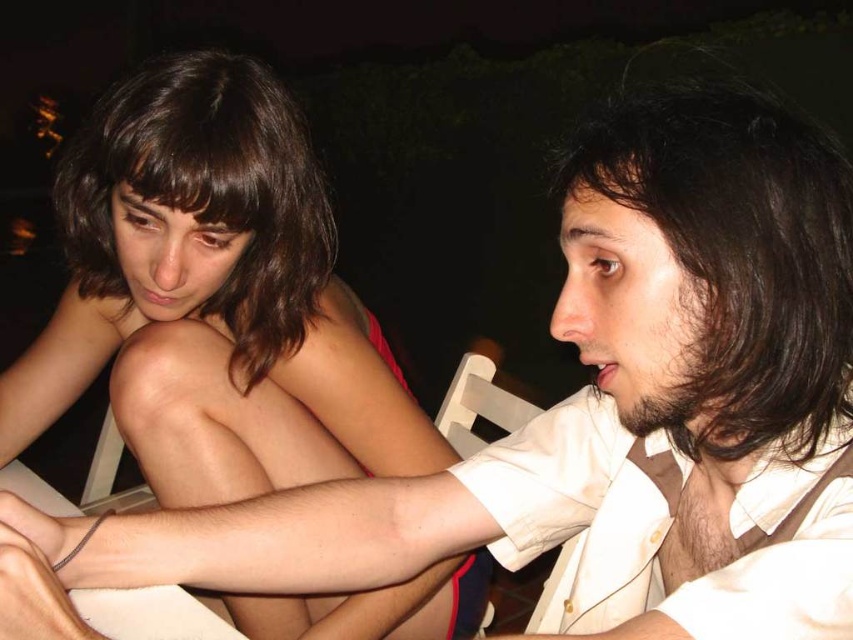
Is dark brown wavy hair at right thinner than dark brown wavy hair at upper left?

Yes.

The height and width of the screenshot is (640, 853). In order to click on dark brown wavy hair at right in this screenshot , I will do `click(735, 259)`.

Is point (827, 308) in front of point (294, 177)?

That is True.

You are a GUI agent. You are given a task and a screenshot of the screen. Output one action in this format:
    pyautogui.click(x=<x>, y=<y>)
    Task: Click on the dark brown wavy hair at right
    Image resolution: width=853 pixels, height=640 pixels.
    Given the screenshot: What is the action you would take?
    tap(735, 259)

In the scene shown: Is brown hair at upper left above dark brown wavy hair at right?

No, brown hair at upper left is not above dark brown wavy hair at right.

Between point (6, 372) and point (807, 323), which one is positioned in front?

Point (807, 323) is in front.

Is point (123, 408) behind point (660, 172)?

Yes, it is behind point (660, 172).

You are a GUI agent. You are given a task and a screenshot of the screen. Output one action in this format:
    pyautogui.click(x=<x>, y=<y>)
    Task: Click on the brown hair at upper left
    
    Given the screenshot: What is the action you would take?
    pyautogui.click(x=213, y=298)

Who is higher up, brown hair at upper left or dark brown wavy hair at upper left?

Positioned higher is dark brown wavy hair at upper left.

Find the location of a particular element. This screenshot has width=853, height=640. brown hair at upper left is located at coordinates (213, 298).

Who is more distant from viewer, (151, 385) or (97, 128)?

The point (151, 385) is behind.

Where is `brown hair at upper left`? brown hair at upper left is located at coordinates (213, 298).